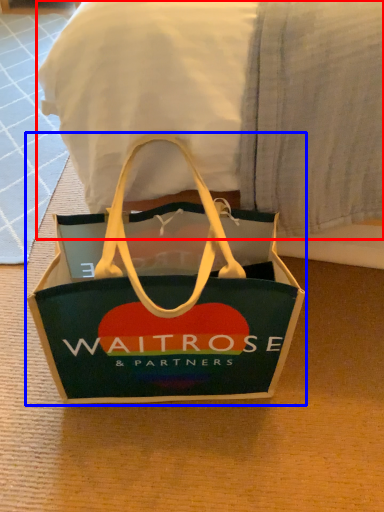
Question: Which of the following is the farthest to the observer, bedding (highlighted by a red box) or handbag (highlighted by a blue box)?

Choices:
 (A) bedding
 (B) handbag

Answer: (B)